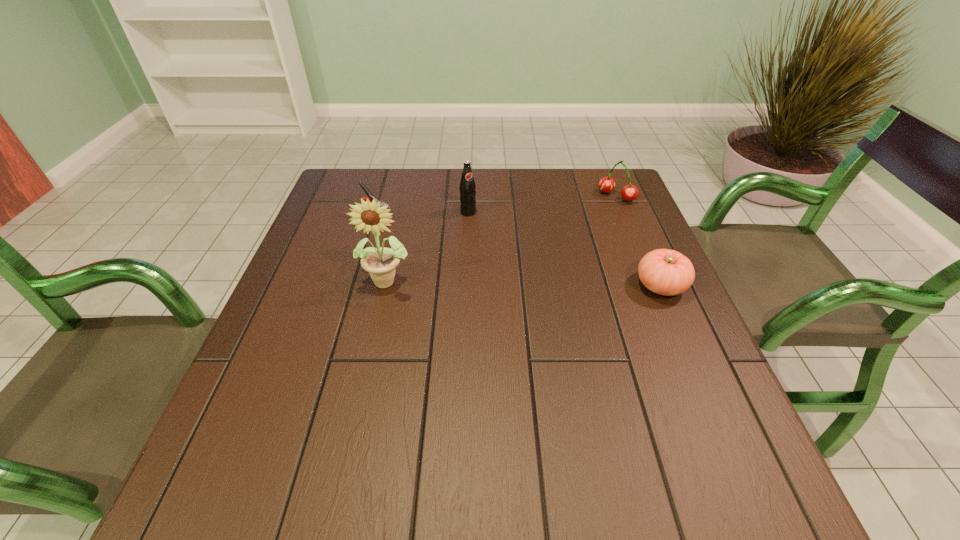
You are a GUI agent. You are given a task and a screenshot of the screen. Output one action in this format:
    pyautogui.click(x=<x>, y=<y>)
    Task: Click on the object situated at the left edge
    
    Given the screenshot: What is the action you would take?
    pyautogui.click(x=370, y=197)

What are the coordinates of `tomato at the right edge` in the screenshot? It's located at (666, 272).

Locate an element on the screen. The width and height of the screenshot is (960, 540). cherry located in the right edge section of the desktop is located at coordinates (630, 192).

You are a GUI agent. You are given a task and a screenshot of the screen. Output one action in this format:
    pyautogui.click(x=<x>, y=<y>)
    Task: Click on the object positioned at the far left corner
    
    Given the screenshot: What is the action you would take?
    pyautogui.click(x=370, y=197)

Identify the location of object positioned at the far right corner. (630, 192).

Where is `vacant area at the far edge`? This screenshot has width=960, height=540. vacant area at the far edge is located at coordinates (513, 174).

The height and width of the screenshot is (540, 960). Identify the location of free region at the near edge of the desktop. (505, 428).

Locate an element on the screen. This screenshot has height=540, width=960. free location at the left edge of the desktop is located at coordinates (273, 369).

Find the location of a particular element. The width and height of the screenshot is (960, 540). free space at the right edge is located at coordinates (698, 337).

You are a GUI agent. You are given a task and a screenshot of the screen. Output one action in this format:
    pyautogui.click(x=<x>, y=<y>)
    Task: Click on the free location at the far left corner
    
    Given the screenshot: What is the action you would take?
    pyautogui.click(x=349, y=170)